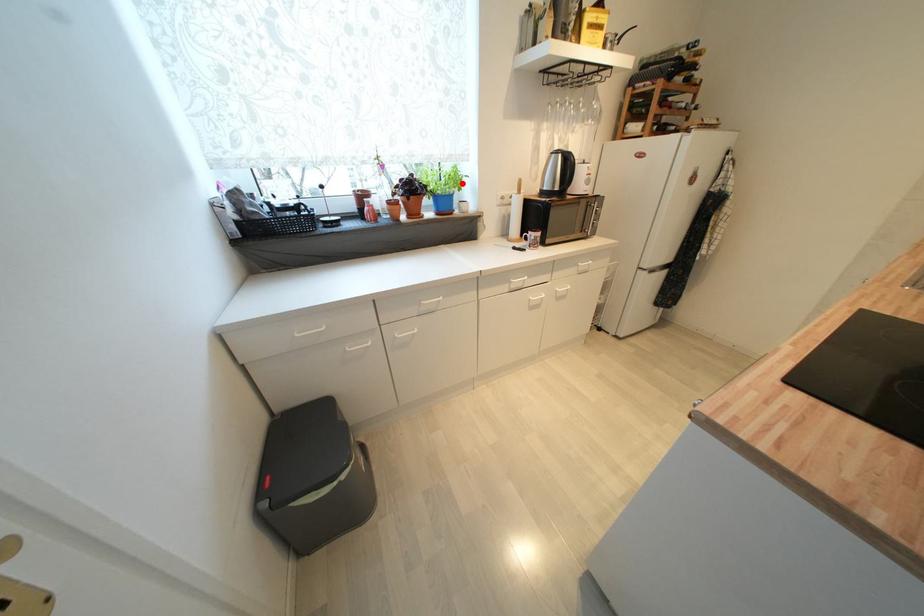
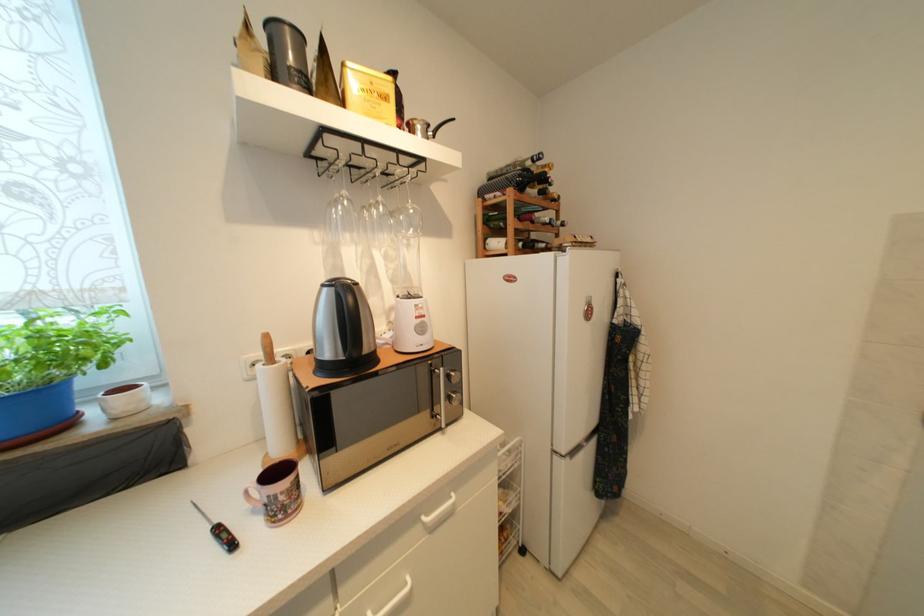
In the second image, find the point that corresponds to the highlighted location in the first image.

(77, 353)